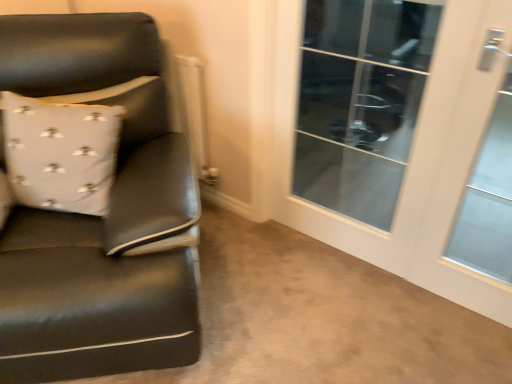
Question: From a real-world perspective, is matte black leather chair at left above or below white glossy door at right, arranged as the second screen door when viewed from the left?

Choices:
 (A) below
 (B) above

Answer: (A)

Question: From the image's perspective, is matte black leather chair at left positioned above or below white glossy door at right, arranged as the second screen door when viewed from the left?

Choices:
 (A) above
 (B) below

Answer: (B)

Question: Considering the real-world distances, which object is closest to the white textured pillow at left?

Choices:
 (A) transparent glass door at upper right
 (B) white glossy door at right, which is counted as the first screen door, starting from the right
 (C) matte black leather chair at left
 (D) transparent glass door at right, which is counted as the second screen door, starting from the right

Answer: (C)

Question: Which of these objects is positioned closest to the white glossy door at right, arranged as the second screen door when viewed from the left?

Choices:
 (A) white textured pillow at left
 (B) transparent glass door at upper right
 (C) matte black leather chair at left
 (D) transparent glass door at right, which is counted as the second screen door, starting from the right

Answer: (D)